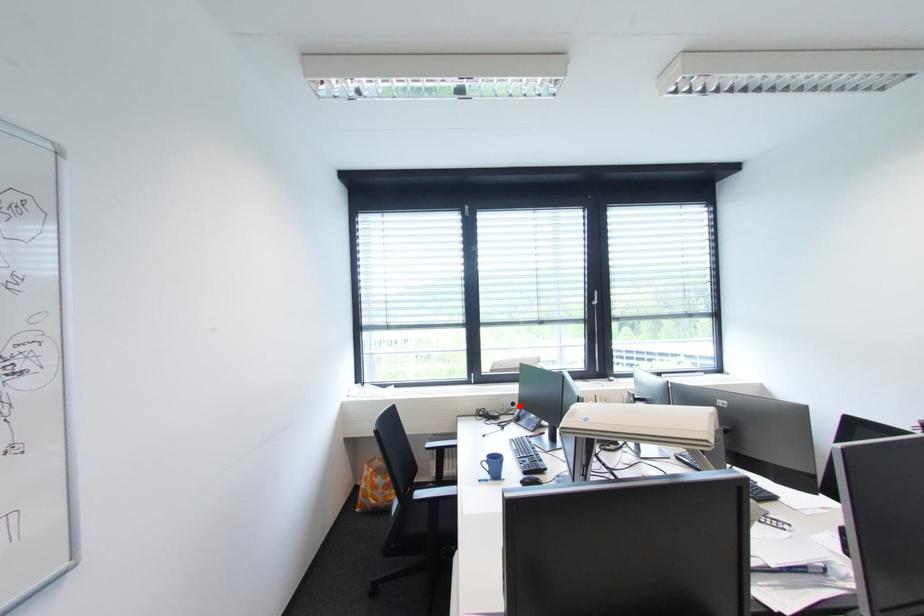
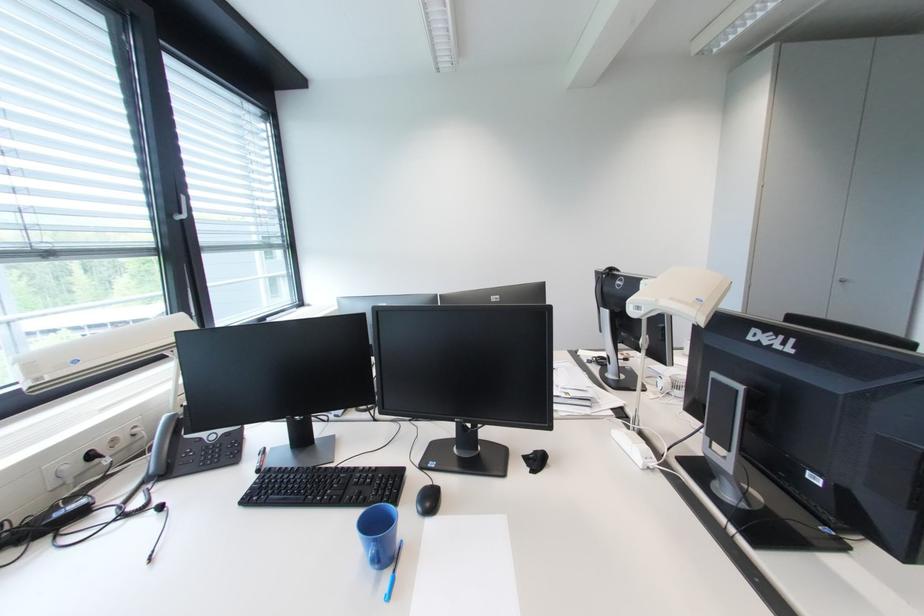
Question: I am providing you with two images of the same scene from different viewpoints. In image1, a red point is highlighted. Considering the same 3D point in image2, which of the following is correct?

Choices:
 (A) It is closer
 (B) It is farther

Answer: (A)